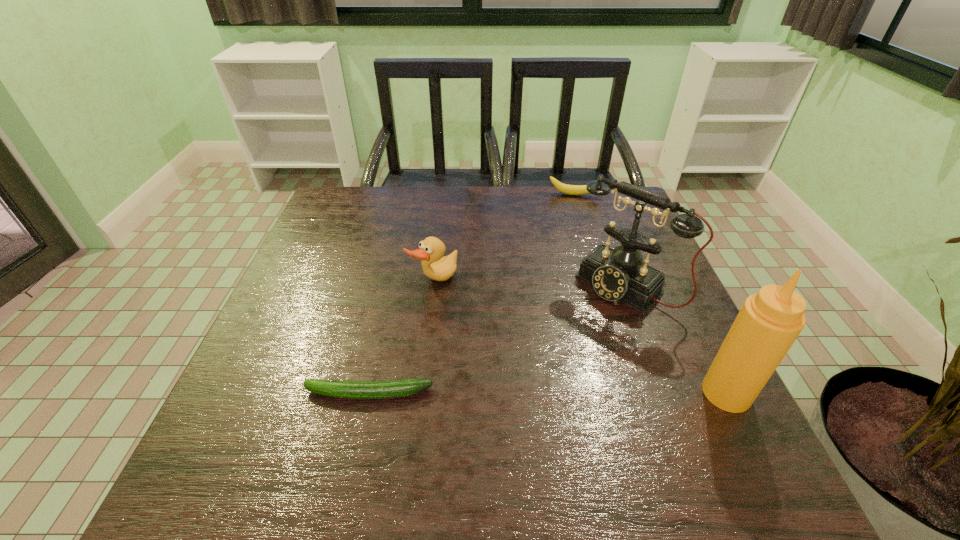
Where is `vacant region between the condiment and the fourth shortest object`? The height and width of the screenshot is (540, 960). vacant region between the condiment and the fourth shortest object is located at coordinates pos(675,340).

Where is `empty space between the zucchini and the telephone`? empty space between the zucchini and the telephone is located at coordinates (496, 340).

I want to click on vacant area that lies between the duck and the telephone, so click(x=529, y=284).

Identify the location of vacant area that lies between the telephone and the condiment. (675, 340).

The height and width of the screenshot is (540, 960). What are the coordinates of `vacant area between the third tallest object and the fourth shortest object` in the screenshot? It's located at (529, 284).

Find the location of `object that stands as the closest to the banana`. object that stands as the closest to the banana is located at coordinates (616, 274).

Locate an element on the screen. This screenshot has height=540, width=960. object that is the second closest to the shortest object is located at coordinates (616, 274).

Where is `free space that satisfies the following two spatial constraints: 1. on the front side of the fourth shortest object; 2. on the left side of the fourth tallest object`? The height and width of the screenshot is (540, 960). free space that satisfies the following two spatial constraints: 1. on the front side of the fourth shortest object; 2. on the left side of the fourth tallest object is located at coordinates (604, 286).